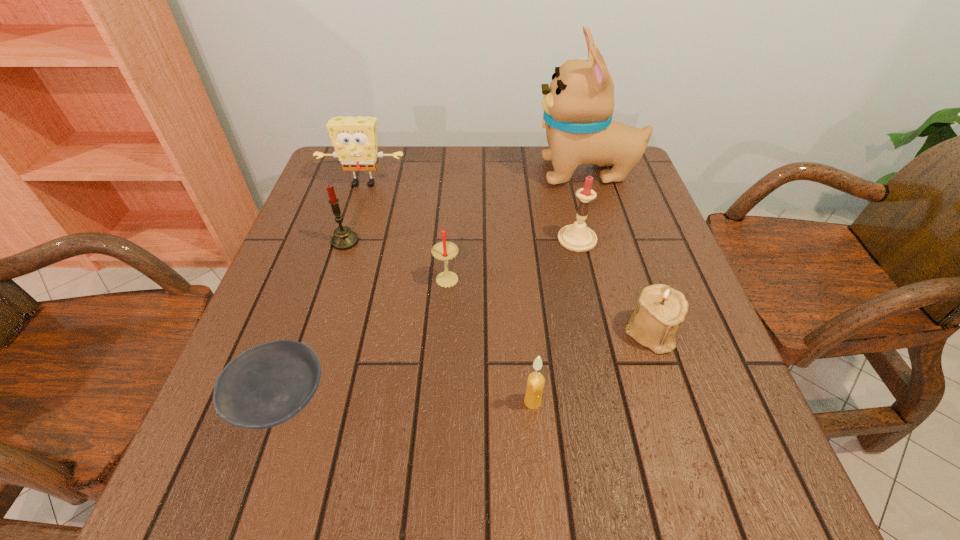
Locate an element on the screen. This screenshot has width=960, height=540. free spot that satisfies the following two spatial constraints: 1. on the back side of the third nearest object; 2. on the left side of the nearest candle is located at coordinates (526, 333).

Identify the location of free spot that satisfies the following two spatial constraints: 1. on the back side of the fourth nearest object; 2. on the left side of the bowl. (324, 277).

The width and height of the screenshot is (960, 540). What are the coordinates of `free region that satisfies the following two spatial constraints: 1. on the face of the fourth object from left to right; 2. on the left side of the sponge` in the screenshot? It's located at (334, 277).

Where is `vacant area that satisfies the following two spatial constraints: 1. on the face of the sponge; 2. on the right side of the rightmost candle`? The image size is (960, 540). vacant area that satisfies the following two spatial constraints: 1. on the face of the sponge; 2. on the right side of the rightmost candle is located at coordinates tap(346, 239).